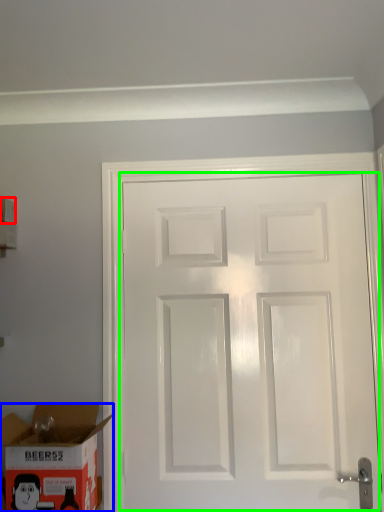
Question: Which object is positioned farthest from box (highlighted by a red box)? Select from box (highlighted by a blue box) and door (highlighted by a green box).

Choices:
 (A) box
 (B) door

Answer: (B)